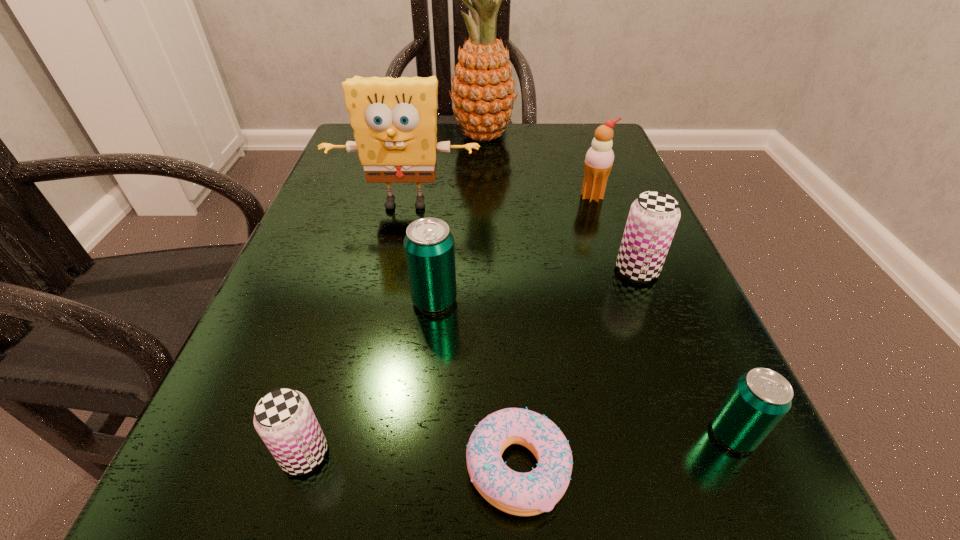
Identify the location of vacant area at the right edge. The width and height of the screenshot is (960, 540). (772, 477).

Identify the location of vacant area at the far left corner of the desktop. This screenshot has height=540, width=960. (348, 129).

Find the location of `vacant space at the near left corner of the desktop`. vacant space at the near left corner of the desktop is located at coordinates (294, 528).

Locate an element on the screen. vacant space at the far right corner of the desktop is located at coordinates (553, 143).

Locate an element on the screen. This screenshot has height=540, width=960. vacant area that lies between the right teal beer can and the second beer can from left to right is located at coordinates (584, 367).

Identify the location of unoccupied area between the leftmost beer can and the farther teal beer can. The image size is (960, 540). (370, 377).

Locate an element on the screen. This screenshot has width=960, height=540. vacant space in between the smaller purple beer can and the farther purple beer can is located at coordinates (470, 362).

The image size is (960, 540). In order to click on vacant area between the smaller teal beer can and the doughnut in this screenshot , I will do `click(625, 450)`.

You are a GUI agent. You are given a task and a screenshot of the screen. Output one action in this format:
    pyautogui.click(x=<x>, y=<y>)
    Task: Click on the empty location between the nearer teal beer can and the second tallest object
    This screenshot has width=960, height=540.
    Given the screenshot: What is the action you would take?
    click(x=569, y=319)

At what (x,y) coordinates should I click in order to perform the action: click on empty space that is in between the nearer purple beer can and the right teal beer can. Please return your answer as a coordinate pair (x, y). Looking at the image, I should click on (518, 444).